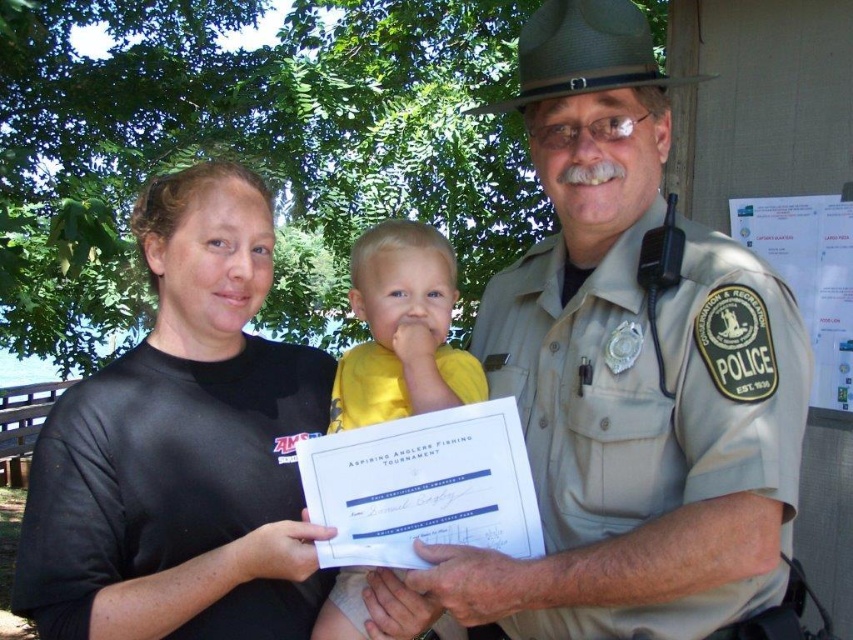
Is khaki uniform at center smaller than yellow cotton shirt at center?

No.

Consider the image. Can you confirm if khaki uniform at center is bigger than yellow cotton shirt at center?

Yes.

The height and width of the screenshot is (640, 853). Describe the element at coordinates (630, 372) in the screenshot. I see `khaki uniform at center` at that location.

Locate an element on the screen. The image size is (853, 640). khaki uniform at center is located at coordinates (630, 372).

What do you see at coordinates (630, 372) in the screenshot? Image resolution: width=853 pixels, height=640 pixels. I see `khaki uniform at center` at bounding box center [630, 372].

Which is more to the left, khaki uniform at center or black matte shirt at center?

black matte shirt at center

Is point (531, 339) positioned in front of point (74, 477)?

No, it is not.

You are a GUI agent. You are given a task and a screenshot of the screen. Output one action in this format:
    pyautogui.click(x=<x>, y=<y>)
    Task: Click on the khaki uniform at center
    The width and height of the screenshot is (853, 640).
    Given the screenshot: What is the action you would take?
    pyautogui.click(x=630, y=372)

Does black matte shirt at center have a greater width compared to yellow cotton shirt at center?

Correct, the width of black matte shirt at center exceeds that of yellow cotton shirt at center.

Is point (125, 516) positioned before point (337, 618)?

That is True.

The height and width of the screenshot is (640, 853). Find the location of `black matte shirt at center`. black matte shirt at center is located at coordinates (183, 448).